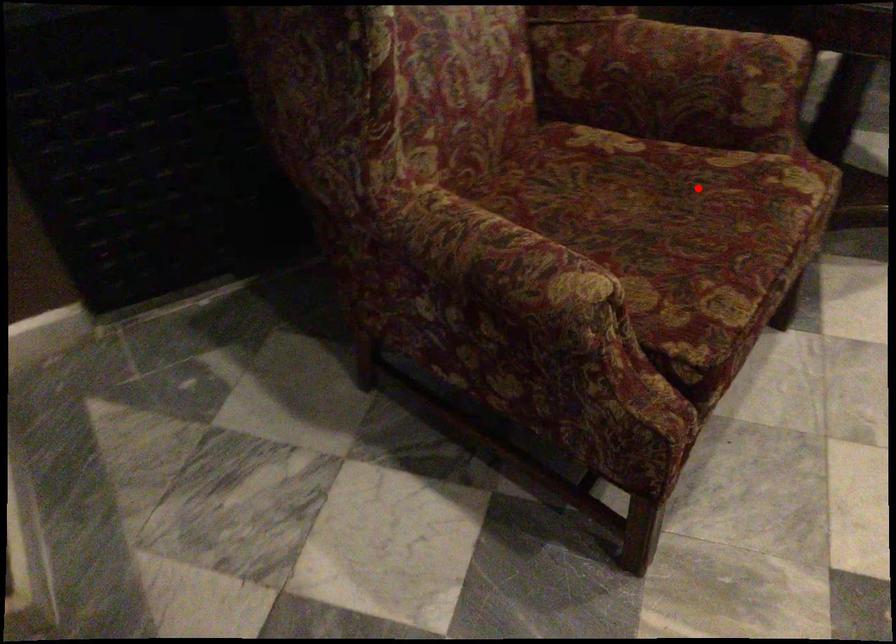
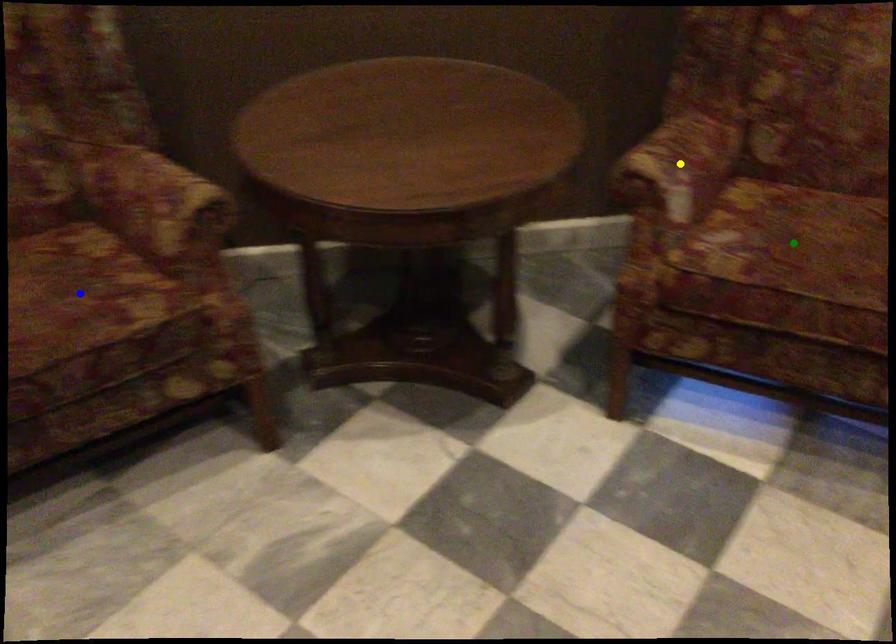
Question: I am providing you with two images of the same scene from different viewpoints. A red point is marked on the first image. You are given multiple points on the second image. In image 2, which mark is for the same physical point as the one in image 1?

Choices:
 (A) green point
 (B) blue point
 (C) yellow point

Answer: (B)